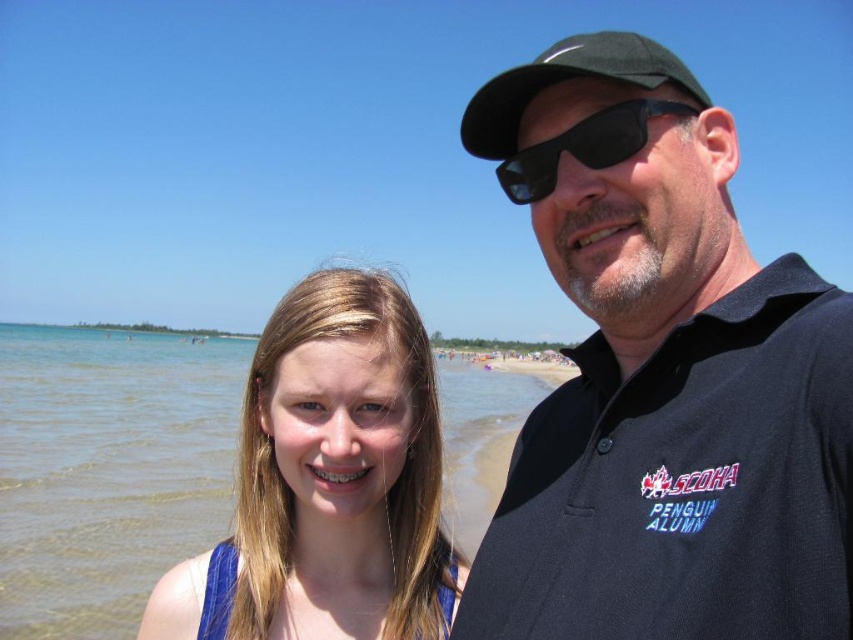
Can you confirm if black matte cap at upper right is thinner than blonde hair at center?

Indeed, black matte cap at upper right has a lesser width compared to blonde hair at center.

Who is shorter, black matte cap at upper right or blonde hair at center?

blonde hair at center

Does point (764, 333) lie in front of point (316, 492)?

Yes, it is in front of point (316, 492).

Identify the location of black matte cap at upper right. (662, 376).

Between black matte cap at upper right and black matte sunglasses at upper center, which one has less height?

black matte sunglasses at upper center

Is black matte cap at upper right shorter than black matte sunglasses at upper center?

No, black matte cap at upper right is not shorter than black matte sunglasses at upper center.

I want to click on black matte cap at upper right, so click(x=662, y=376).

Looking at this image, between black matte cap at upper right and green fabric baseball cap at upper right, which one has more height?

Standing taller between the two is green fabric baseball cap at upper right.

Identify the location of black matte cap at upper right. This screenshot has height=640, width=853. (662, 376).